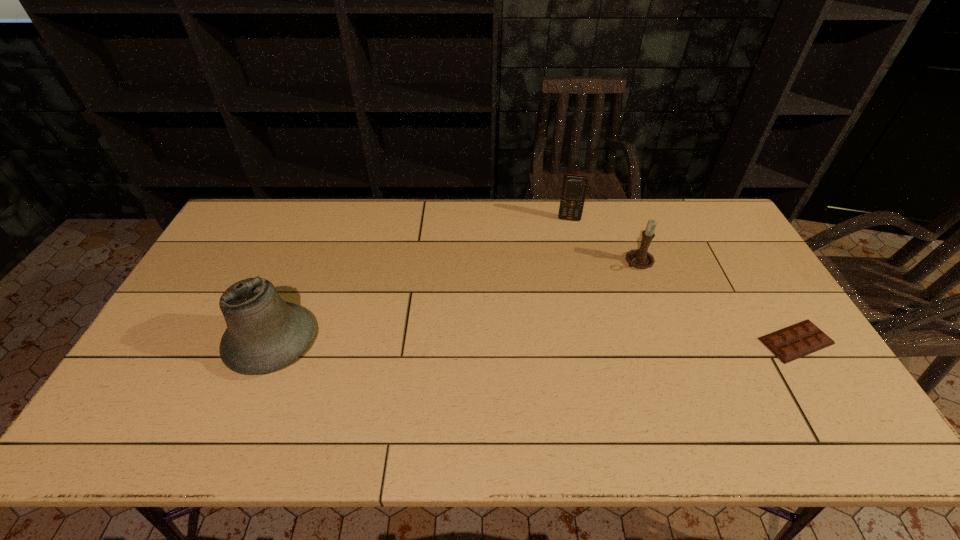
The image size is (960, 540). Identify the location of free space on the desktop that is between the bell and the shortest object and is positioned on the side of the third object from left to right with the handle. (525, 342).

Where is `vacant spot on the desktop that is between the leftmost object and the shortest object and is positioned on the screen of the second object from left to right`? The width and height of the screenshot is (960, 540). vacant spot on the desktop that is between the leftmost object and the shortest object and is positioned on the screen of the second object from left to right is located at coordinates (562, 342).